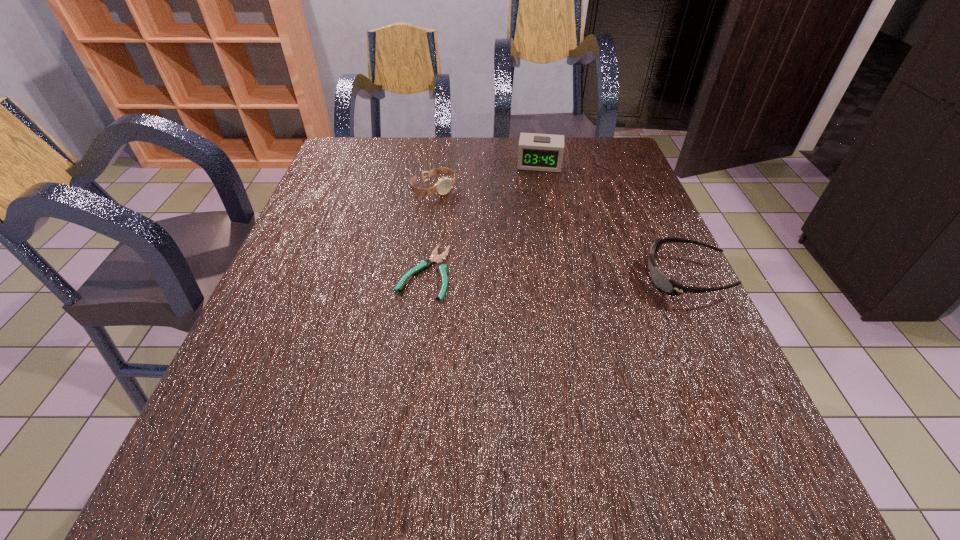
This screenshot has width=960, height=540. What are the coordinates of `free space located 0.160m on the front-facing side of the second object from right to left` in the screenshot? It's located at (535, 204).

Find the location of a particular element. This screenshot has height=540, width=960. free space located on the front-facing side of the second object from right to left is located at coordinates (532, 235).

Where is `vacant space located 0.180m on the face of the watch`? This screenshot has height=540, width=960. vacant space located 0.180m on the face of the watch is located at coordinates (486, 231).

You are a GUI agent. You are given a task and a screenshot of the screen. Output one action in this format:
    pyautogui.click(x=<x>, y=<y>)
    Task: Click on the vacant space located 0.310m on the face of the watch
    This screenshot has width=960, height=540.
    Given the screenshot: What is the action you would take?
    pos(520,260)

This screenshot has width=960, height=540. Identify the location of vacant space located on the face of the watch. (491, 235).

At what (x,y) coordinates should I click in order to perform the action: click on object located at the far edge. Please return your answer as a coordinate pair (x, y). Looking at the image, I should click on (538, 152).

Locate an element on the screen. The height and width of the screenshot is (540, 960). object positioned at the right edge is located at coordinates (668, 286).

This screenshot has height=540, width=960. Identify the location of vacant position at the far edge of the desktop. (407, 172).

The height and width of the screenshot is (540, 960). Find the location of `vacant space at the near edge of the desktop`. vacant space at the near edge of the desktop is located at coordinates (367, 429).

The image size is (960, 540). In order to click on free region at the left edge of the desktop in this screenshot , I will do `click(300, 273)`.